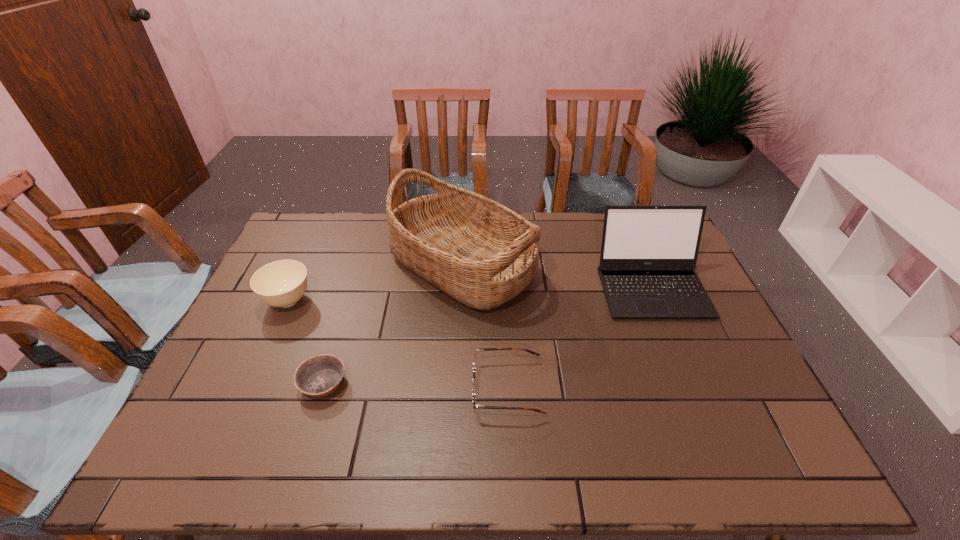
Identify the location of free location located 0.280m on the right of the sugar bowl. The image size is (960, 540). (406, 301).

Where is `vacant region located on the front-facing side of the fourth tallest object`? vacant region located on the front-facing side of the fourth tallest object is located at coordinates (356, 388).

Locate an element on the screen. This screenshot has height=540, width=960. vacant space located 0.120m on the front-facing side of the fourth tallest object is located at coordinates (423, 388).

At what (x,y) coordinates should I click in order to perform the action: click on free location located 0.270m on the front-facing side of the fourth tallest object. Please return your answer as a coordinate pair (x, y). This screenshot has height=540, width=960. Looking at the image, I should click on (364, 388).

Image resolution: width=960 pixels, height=540 pixels. Identify the location of vacant space located 0.360m on the right of the shortest object. (490, 383).

The width and height of the screenshot is (960, 540). Find the location of `object located in the far edge section of the desktop`. object located in the far edge section of the desktop is located at coordinates point(479,252).

At what (x,y) coordinates should I click in order to perform the action: click on object located in the left edge section of the desktop. Please return your answer as a coordinate pair (x, y). The image size is (960, 540). Looking at the image, I should click on click(x=282, y=283).

The image size is (960, 540). Find the location of `object situated at the right edge`. object situated at the right edge is located at coordinates (648, 257).

In the image, there is a desktop. At what (x,y) coordinates should I click in order to perform the action: click on vacant space at the far edge. Please return your answer as a coordinate pair (x, y). The width and height of the screenshot is (960, 540). Looking at the image, I should click on (365, 212).

In the image, there is a desktop. Find the location of `vacant space at the near edge`. vacant space at the near edge is located at coordinates (432, 435).